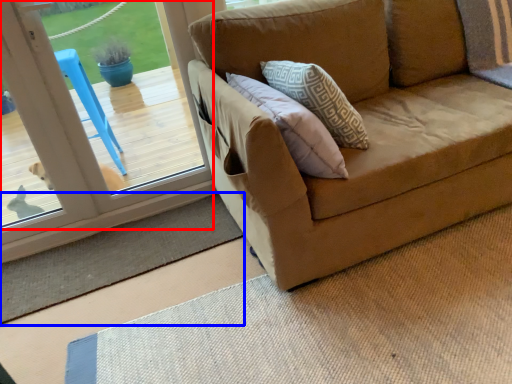
Question: Which point is further to the camera, window (highlighted by a red box) or doormat (highlighted by a blue box)?

Choices:
 (A) window
 (B) doormat

Answer: (B)